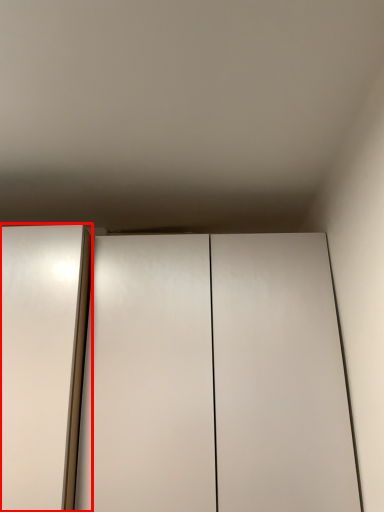
Question: From the image's perspective, where is elevator (annotated by the red box) located in relation to cupboard in the image?

Choices:
 (A) above
 (B) below

Answer: (A)